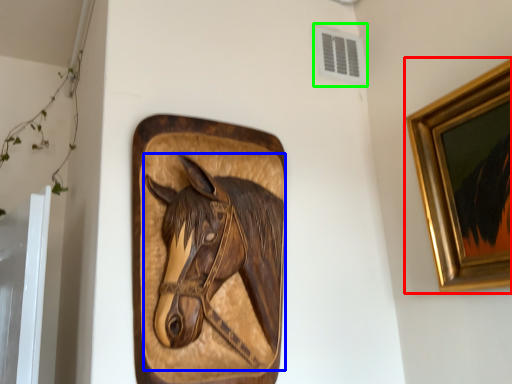
Question: Estimate the real-world distances between objects in this image. Which object is farther from picture frame (highlighted by a red box), horse (highlighted by a blue box) or air conditioning (highlighted by a green box)?

Choices:
 (A) horse
 (B) air conditioning

Answer: (B)